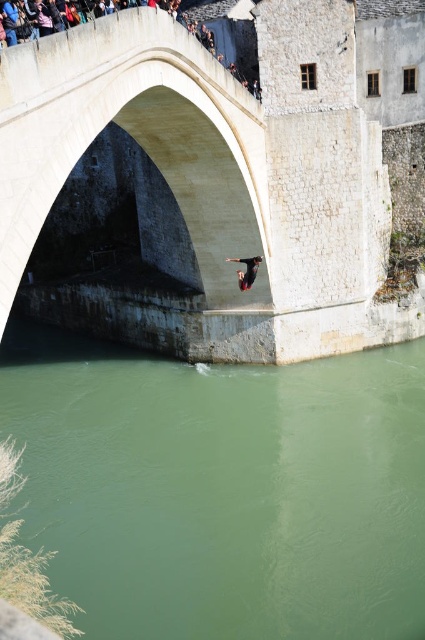
Is white stone arch bridge at center to the left of black matte skateboard at center from the viewer's perspective?

Indeed, white stone arch bridge at center is positioned on the left side of black matte skateboard at center.

Between white stone arch bridge at center and black matte skateboard at center, which one is positioned lower?

black matte skateboard at center

Does point (244, 193) lie in front of point (251, 257)?

Yes.

Image resolution: width=425 pixels, height=640 pixels. What are the coordinates of `white stone arch bridge at center` in the screenshot? It's located at (218, 164).

Does green smooth water at center have a greater width compared to white stone arch bridge at center?

Correct, the width of green smooth water at center exceeds that of white stone arch bridge at center.

Which is above, green smooth water at center or white stone arch bridge at center?

white stone arch bridge at center is above.

Where is `green smooth water at center`? Image resolution: width=425 pixels, height=640 pixels. green smooth water at center is located at coordinates (223, 490).

Which is more to the right, green smooth water at center or black matte skateboard at center?

From the viewer's perspective, black matte skateboard at center appears more on the right side.

Between green smooth water at center and black matte skateboard at center, which one has more height?

green smooth water at center

Measure the distance between point (144,456) and camera.

A distance of 185.39 feet exists between point (144,456) and camera.

Locate an element on the screen. Image resolution: width=425 pixels, height=640 pixels. green smooth water at center is located at coordinates (223, 490).